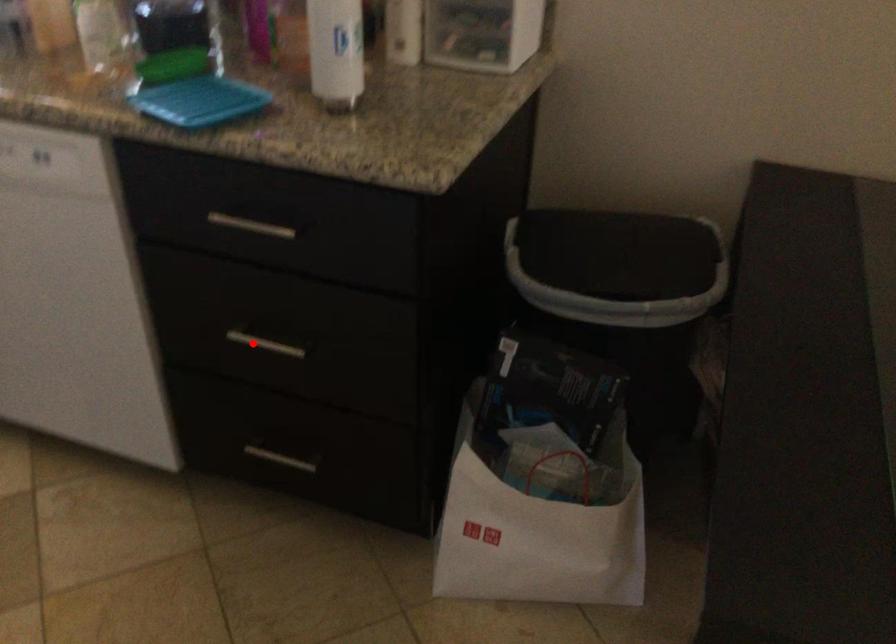
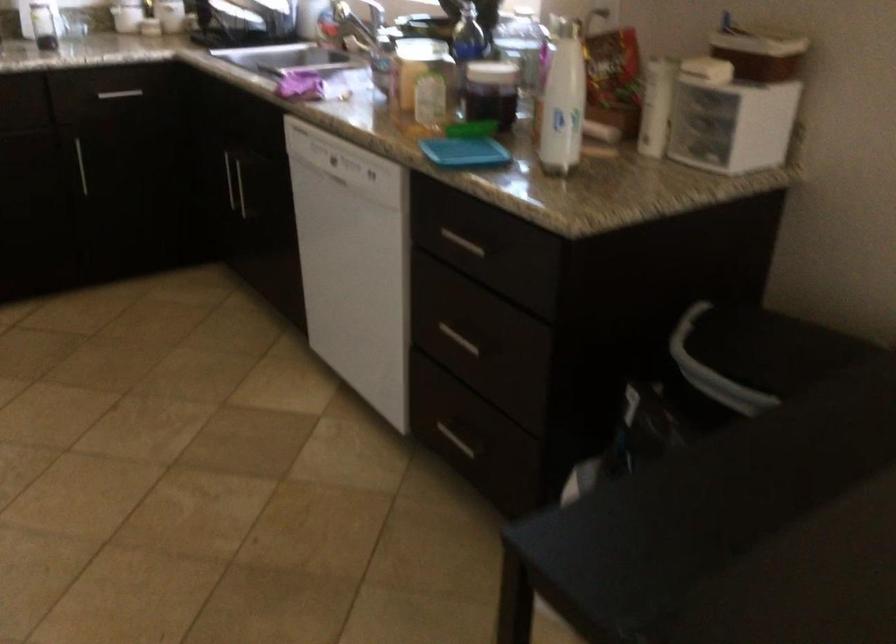
The point at the highlighted location is marked in the first image. Where is the corresponding point in the second image?

(459, 339)